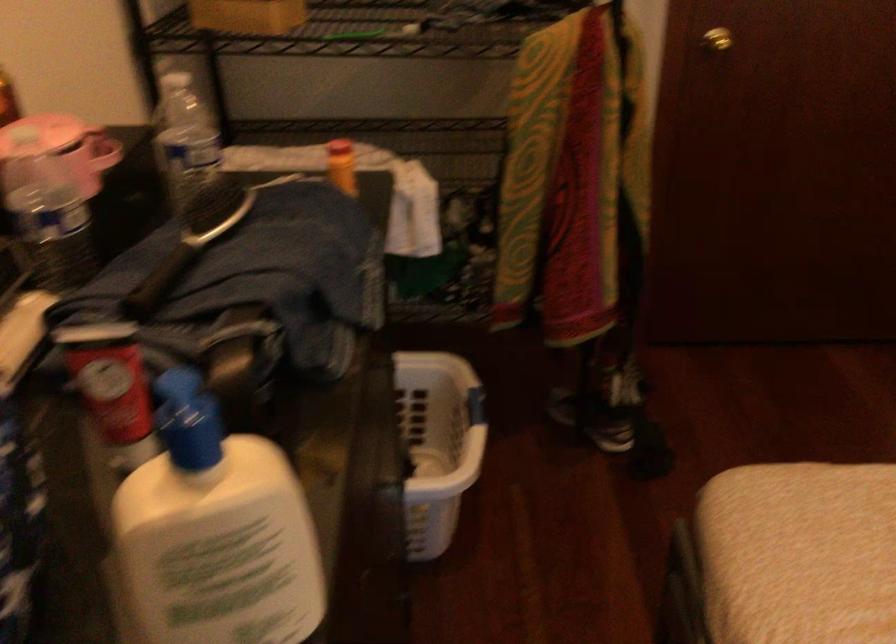
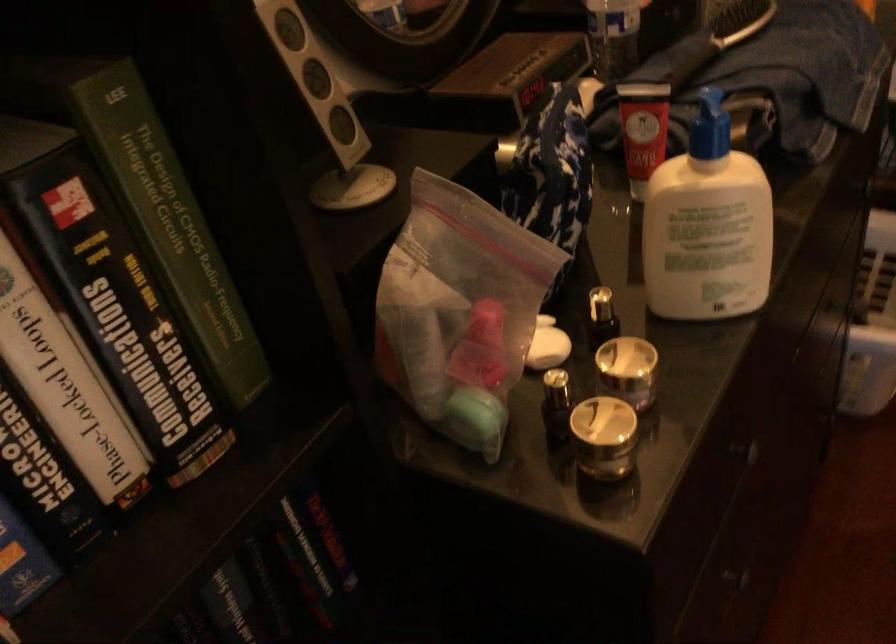
Find the pixel in the second image that matches the point at 222,562 in the first image.

(707, 225)